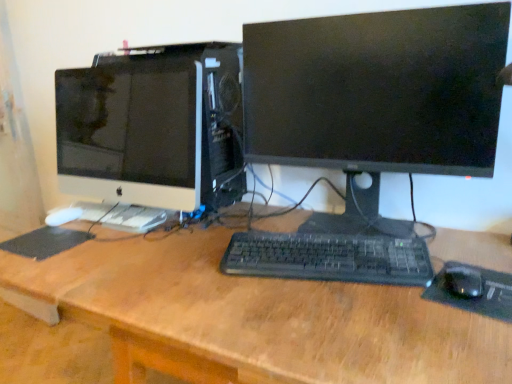
The image size is (512, 384). I want to click on vacant position to the left of black rubber mousepad at lower right, which is the first mousepad from right to left, so click(403, 316).